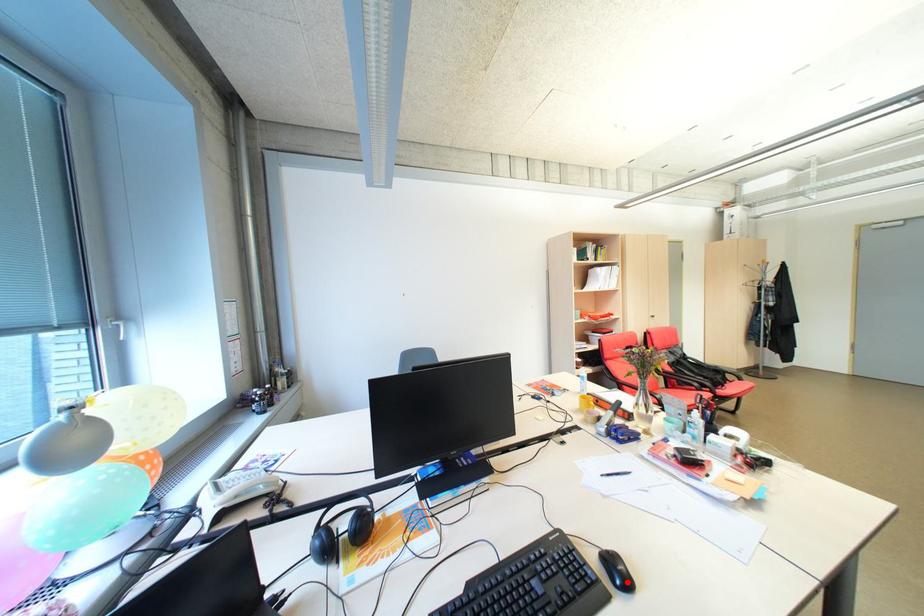
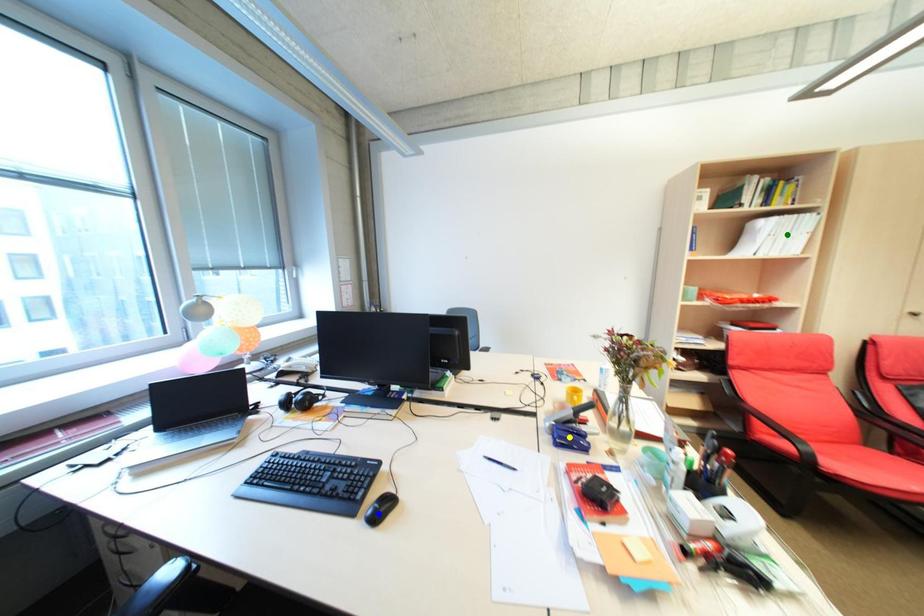
Question: I am providing you with two images of the same scene from different viewpoints. A red point is marked on the first image. You are given multiple points on the second image. Which spot in image 2 lines up with the point in image 1?

Choices:
 (A) blue point
 (B) yellow point
 (C) green point

Answer: (A)